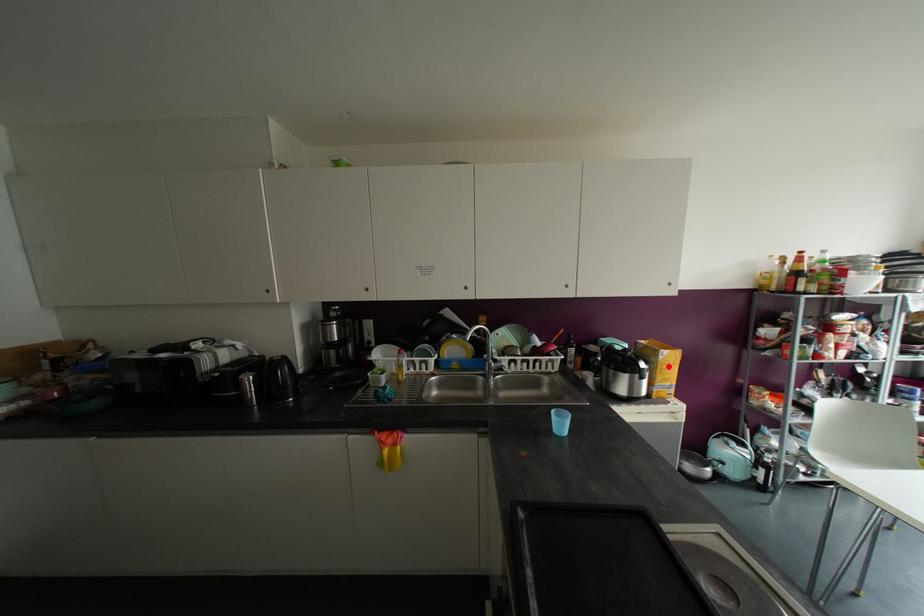
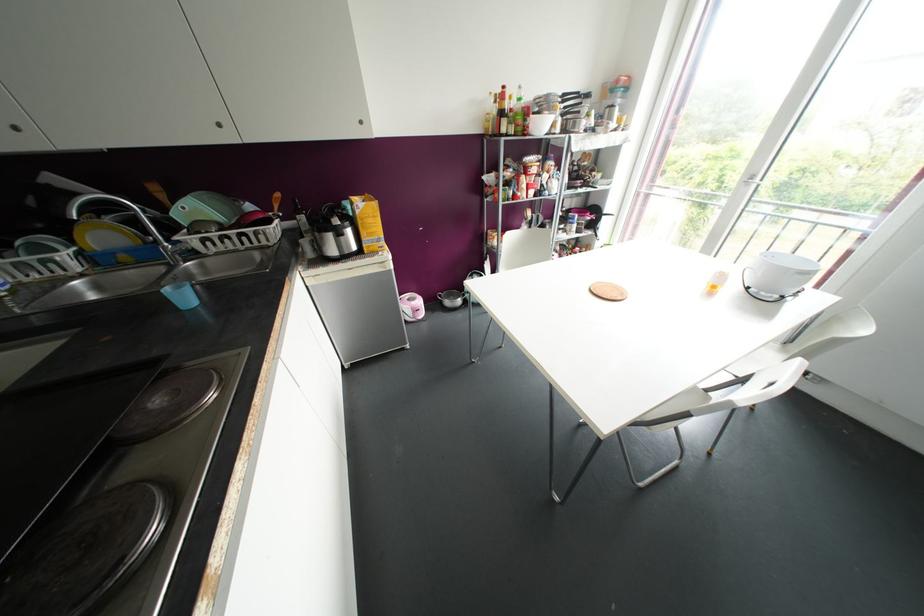
Find the pixel in the second image that matches the highlighted location in the first image.

(370, 220)